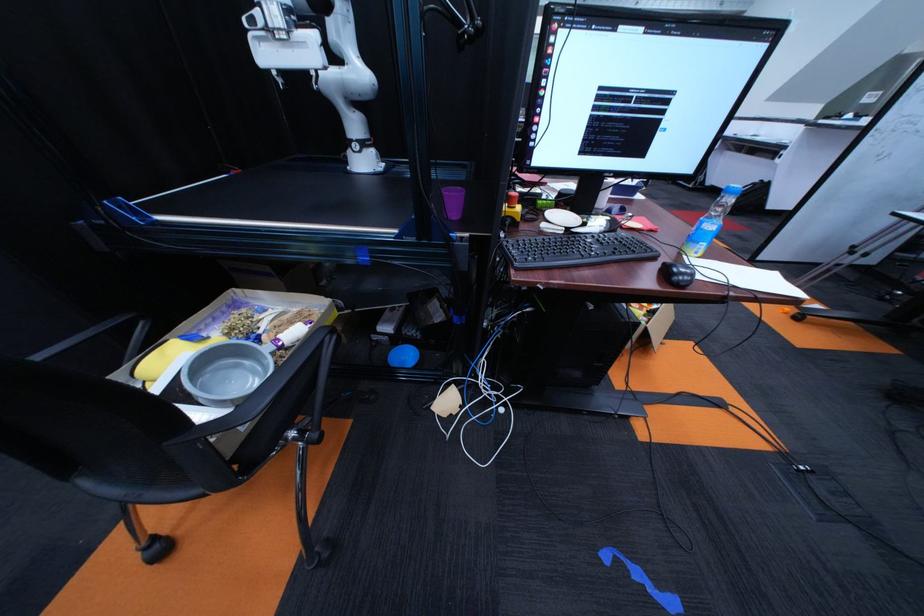
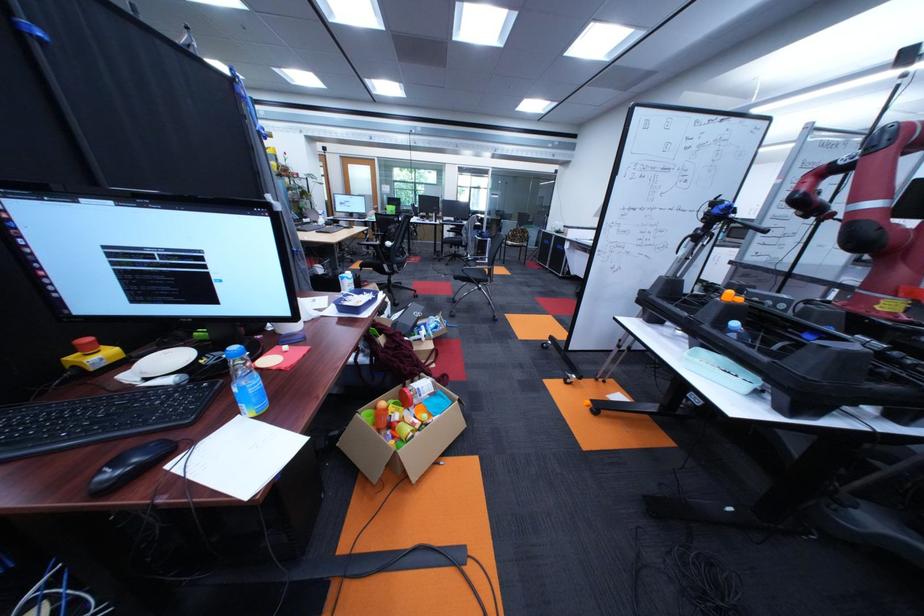
Question: What movement of the cameraman would produce the second image?

Choices:
 (A) Left
 (B) Right
 (C) Forward
 (D) Backward

Answer: (B)